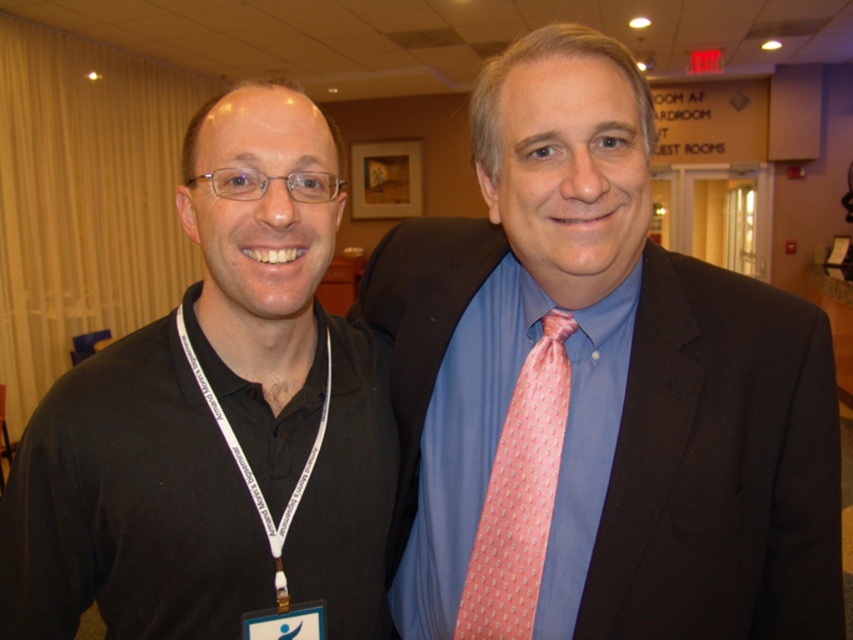
Does pink dotted tie at center appear on the left side of black lanyard at left?

Incorrect, pink dotted tie at center is not on the left side of black lanyard at left.

Which is behind, point (457, 572) or point (363, 602)?

The point (457, 572) is behind.

Consider the image. Who is more distant from viewer, (612, 486) or (213, 557)?

The point (612, 486) is behind.

Where is `pink dotted tie at center`? pink dotted tie at center is located at coordinates (604, 385).

Does point (392, 556) lie behind point (526, 634)?

Yes, point (392, 556) is behind point (526, 634).

Between pink dotted tie at center and pink silk tie at center, which one is positioned higher?

pink dotted tie at center is higher up.

This screenshot has height=640, width=853. I want to click on pink dotted tie at center, so pos(604,385).

Where is `pink dotted tie at center`? Image resolution: width=853 pixels, height=640 pixels. pink dotted tie at center is located at coordinates (604, 385).

Between black lanyard at left and pink silk tie at center, which one appears on the left side from the viewer's perspective?

From the viewer's perspective, black lanyard at left appears more on the left side.

Is black lanyard at left thinner than pink silk tie at center?

No.

Does point (334, 388) lie behind point (566, 326)?

Yes, it is.

Locate an element on the screen. This screenshot has height=640, width=853. black lanyard at left is located at coordinates (215, 419).